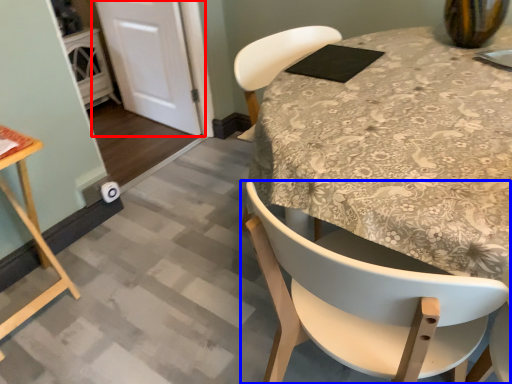
Question: Which of the following is the farthest to the observer, door (highlighted by a red box) or chair (highlighted by a blue box)?

Choices:
 (A) door
 (B) chair

Answer: (A)